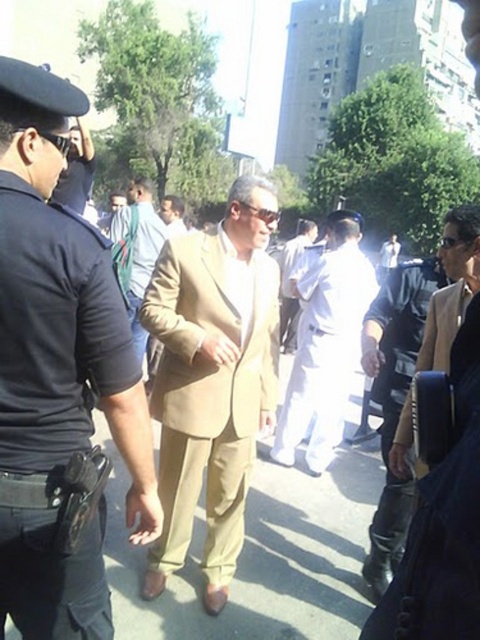
Question: Can you confirm if tan fabric suit at center is positioned below white cotton shirt at center?

Choices:
 (A) no
 (B) yes

Answer: (A)

Question: Which point is closer to the camera?

Choices:
 (A) (346, 240)
 (B) (215, 548)

Answer: (B)

Question: Which object is positioned farthest from the white cotton shirt at center?

Choices:
 (A) light brown suit at center
 (B) tan fabric suit at center
 (C) matte khaki suit at center
 (D) beige fabric suit at center

Answer: (B)

Question: Is beige fabric suit at center wider than light brown suit at center?

Choices:
 (A) yes
 (B) no

Answer: (A)

Question: Which of the following is the farthest from the observer?

Choices:
 (A) matte khaki suit at center
 (B) white cotton shirt at center

Answer: (B)

Question: Is tan fabric suit at center to the left of beige fabric suit at center from the viewer's perspective?

Choices:
 (A) no
 (B) yes

Answer: (A)